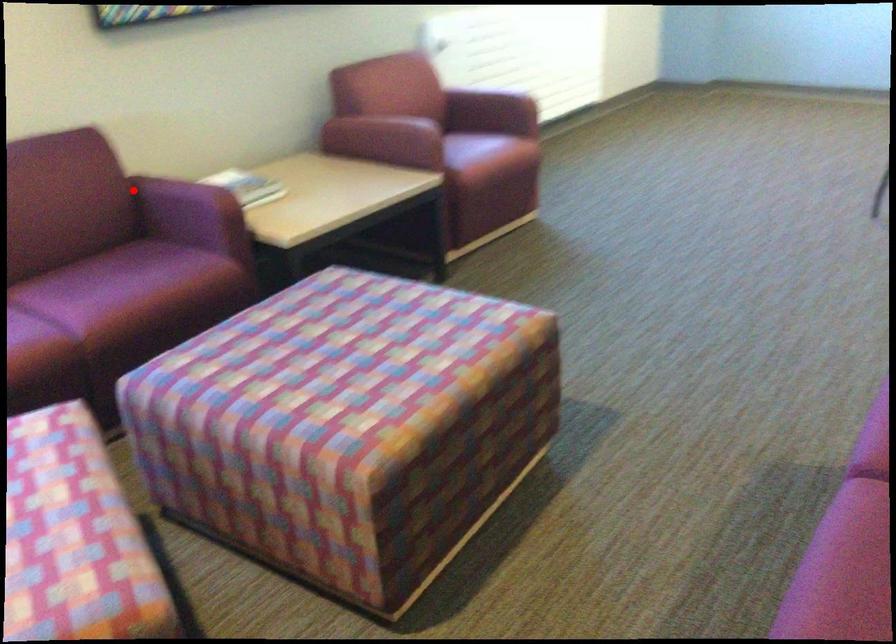
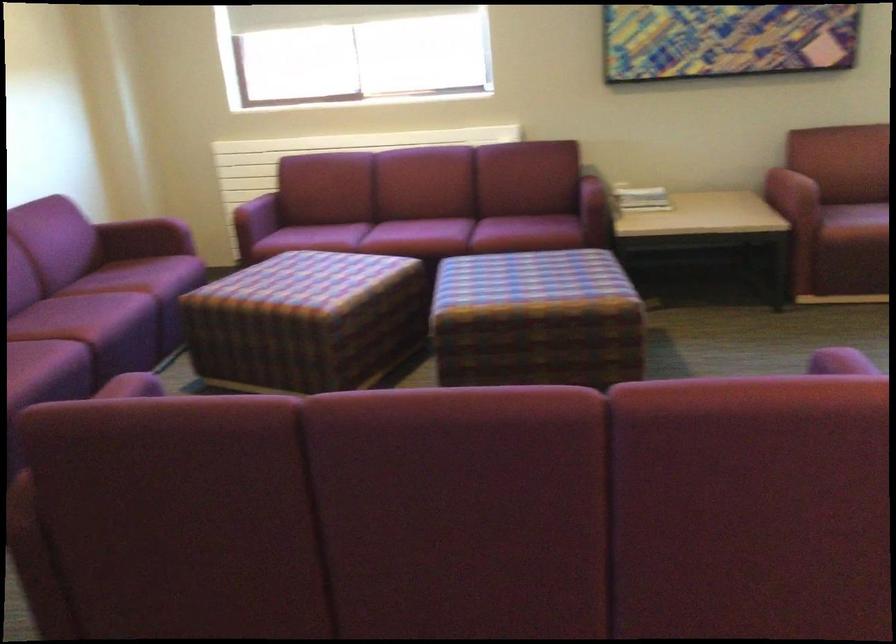
Question: A red point is marked in image1. In image2, is the corresponding 3D point closer to the camera or farther? Reply with the corresponding letter.

Choices:
 (A) The corresponding 3D point is closer.
 (B) The corresponding 3D point is farther.

Answer: (B)